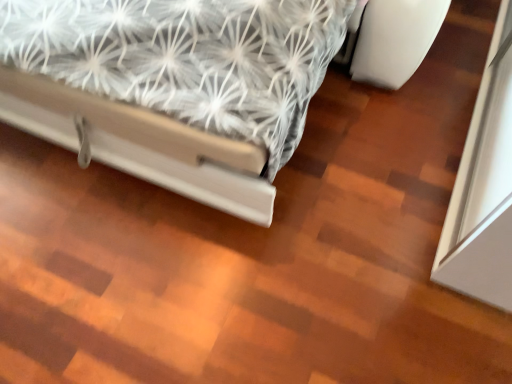
The image size is (512, 384). I want to click on white glossy bed at center, so pyautogui.click(x=173, y=86).

Describe the element at coordinates (173, 86) in the screenshot. I see `white glossy bed at center` at that location.

Locate an element on the screen. white glossy bed at center is located at coordinates (173, 86).